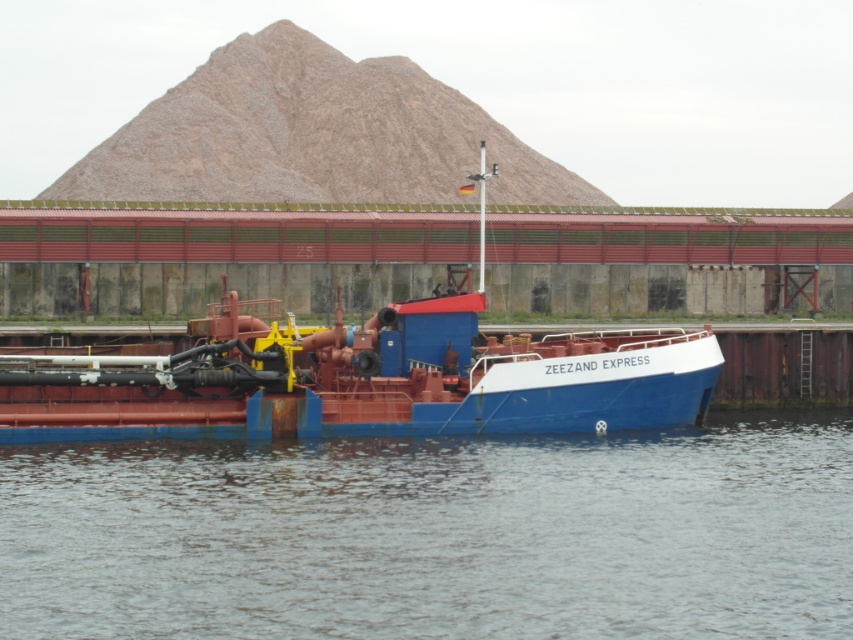
You are standing on the dock and looking at the scene. Which object is closer to you between the transparent water at lower center and the blue matte barge at center?

The transparent water at lower center is closer to the viewer than the blue matte barge at center according to the description.

You are a delivery drone that needs to land on the blue matte barge at center. The landing pad is on the transparent water at lower center. Can you safely land there?

The transparent water at lower center is thinner than the blue matte barge at center, so it may not be able to support the weight of the drone. It is safer to land on the blue matte barge at center instead.